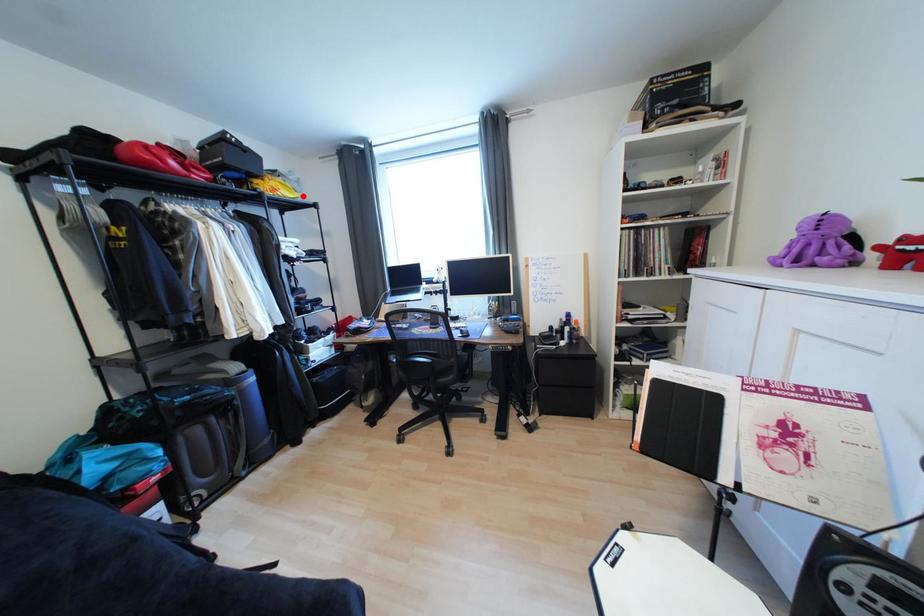
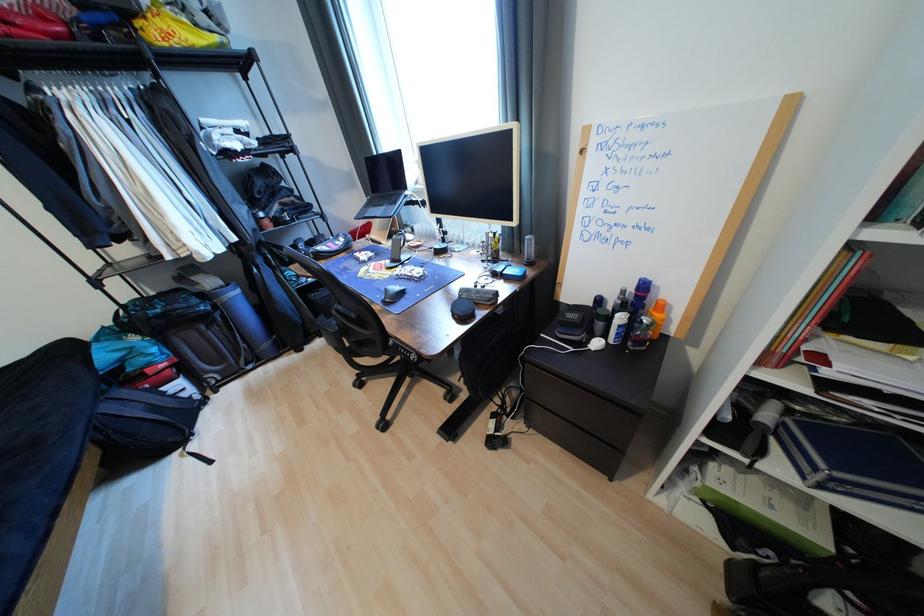
Question: A red point is marked in image1. In image2, is the corresponding 3D point closer to the camera or farther? Reply with the corresponding letter.

Choices:
 (A) The corresponding 3D point is closer.
 (B) The corresponding 3D point is farther.

Answer: (B)